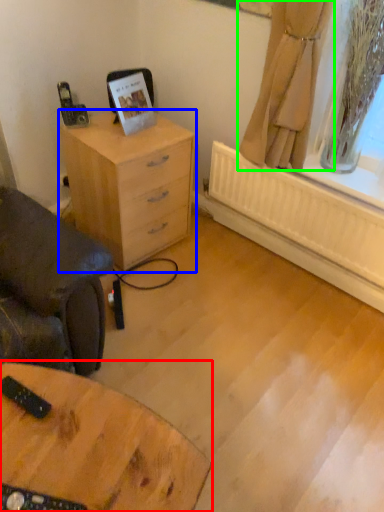
Question: Which object is positioned farthest from table (highlighted by a red box)? Select from chest of drawers (highlighted by a blue box) and curtain (highlighted by a green box).

Choices:
 (A) chest of drawers
 (B) curtain

Answer: (B)